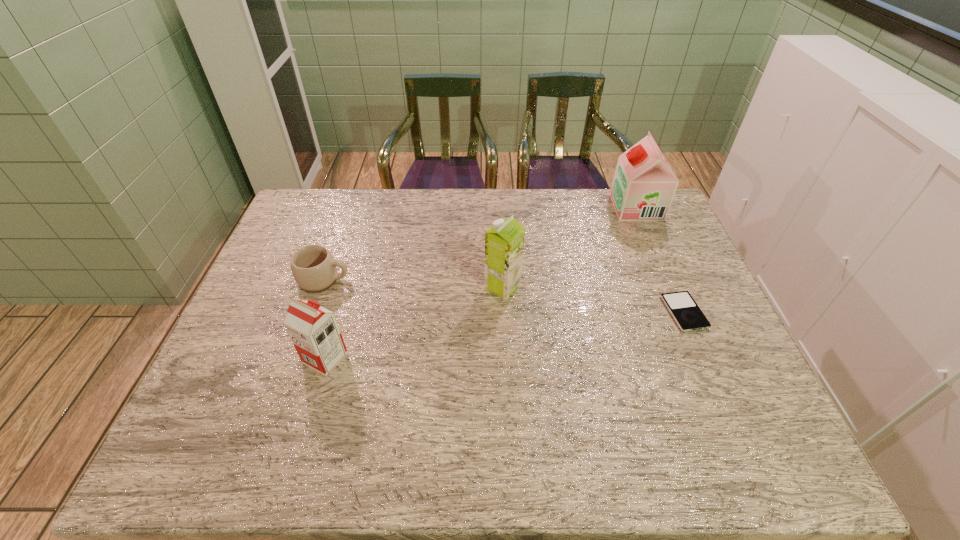
Find the location of a particular element. Image resolution: width=960 pixels, height=540 pixels. the farthest soya milk is located at coordinates (644, 185).

Where is `the farthest object`? This screenshot has width=960, height=540. the farthest object is located at coordinates (644, 185).

The height and width of the screenshot is (540, 960). What are the coordinates of `the second soya milk from left to right` in the screenshot? It's located at point(504,242).

Where is `the third object from right to left`? The width and height of the screenshot is (960, 540). the third object from right to left is located at coordinates (504, 242).

Find the location of a particular element. This screenshot has width=960, height=540. the nearest object is located at coordinates (314, 331).

Find the location of a particular element. The image size is (960, 540). the leftmost soya milk is located at coordinates (314, 331).

The height and width of the screenshot is (540, 960). Find the location of `the fourth tallest object`. the fourth tallest object is located at coordinates (313, 267).

Locate an element on the screen. This screenshot has width=960, height=540. iPod is located at coordinates (685, 311).

Find the location of a particular element. vacant space situated with the cap open on the farthest object is located at coordinates (581, 207).

Where is `vacant space positioned with the cap open on the farthest object`? The image size is (960, 540). vacant space positioned with the cap open on the farthest object is located at coordinates (552, 207).